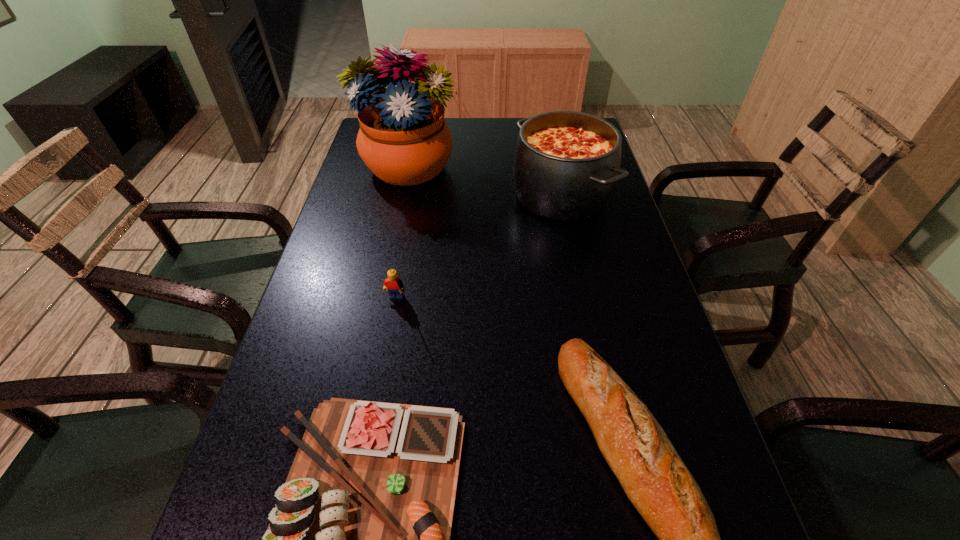
You are a GUI agent. You are given a task and a screenshot of the screen. Output one action in this format:
    pyautogui.click(x=<x>, y=<y>)
    Task: Click on the tallest object
    The height and width of the screenshot is (540, 960).
    Given the screenshot: What is the action you would take?
    pyautogui.click(x=403, y=138)

The width and height of the screenshot is (960, 540). Find the location of `the second tallest object`. the second tallest object is located at coordinates (566, 164).

Locate an element on the screen. This screenshot has height=540, width=960. the third farthest object is located at coordinates (394, 285).

At what (x,y) coordinates should I click in order to perform the action: click on the third shortest object. Please return your answer as a coordinate pair (x, y). The height and width of the screenshot is (540, 960). Looking at the image, I should click on (394, 285).

This screenshot has width=960, height=540. I want to click on vacant space located on the front of the tallest object, so click(376, 306).

The width and height of the screenshot is (960, 540). Find the location of `free space located 0.050m on the front of the second tallest object`. free space located 0.050m on the front of the second tallest object is located at coordinates (572, 247).

Locate an element on the screen. The height and width of the screenshot is (540, 960). free space located on the front-facing side of the third nearest object is located at coordinates (387, 355).

The width and height of the screenshot is (960, 540). I want to click on object that is positioned at the far edge, so click(403, 138).

What are the coordinates of `object situated at the left edge` in the screenshot? It's located at (403, 138).

Where is `object that is at the right edge`? The image size is (960, 540). object that is at the right edge is located at coordinates (566, 164).